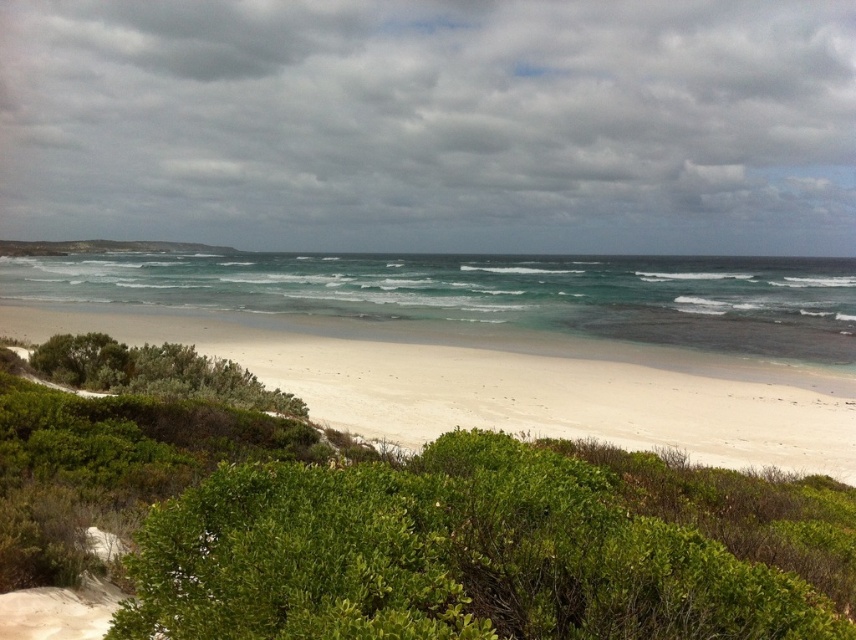
You are standing on the beach and want to walk to the clear blue water at center. Which direction should you head towards from the green leafy bush at lower center?

You should head upwards from the green leafy bush at lower center towards the clear blue water at center, since the green leafy bush at lower center is located below it.